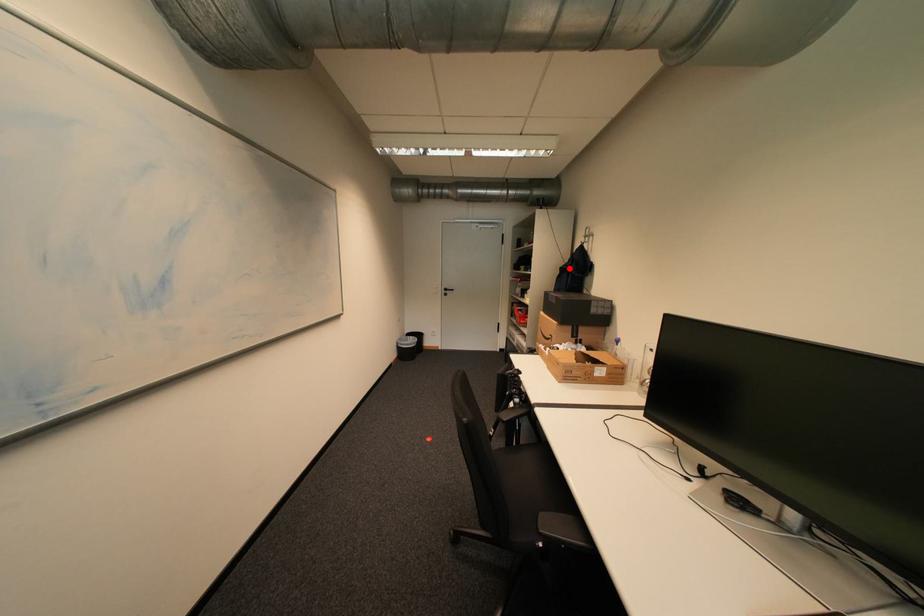
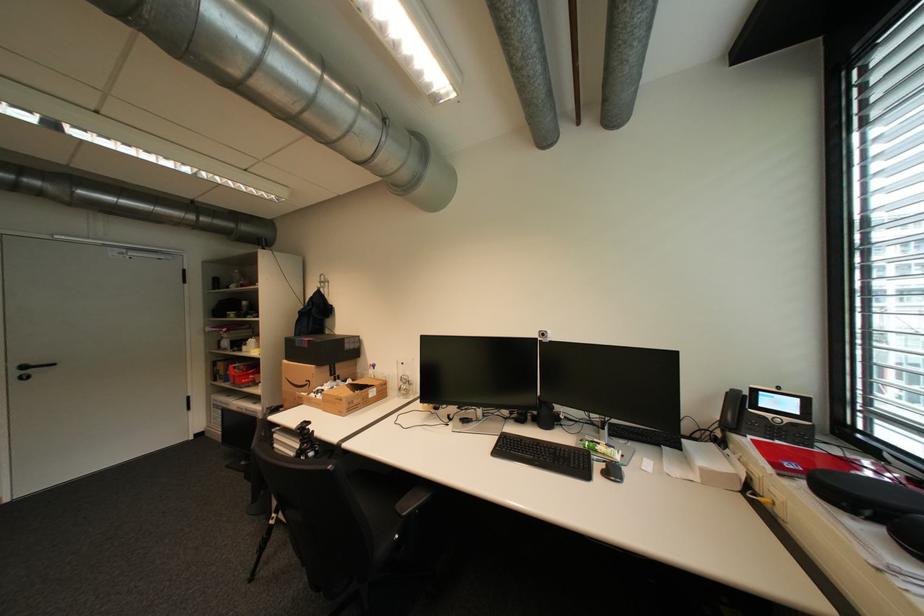
Question: I am providing you with two images of the same scene from different viewpoints. A red point is shown in image1. For the corresponding object point in image2, is it positioned nearer or farther from the camera?

Choices:
 (A) Nearer
 (B) Farther

Answer: (B)